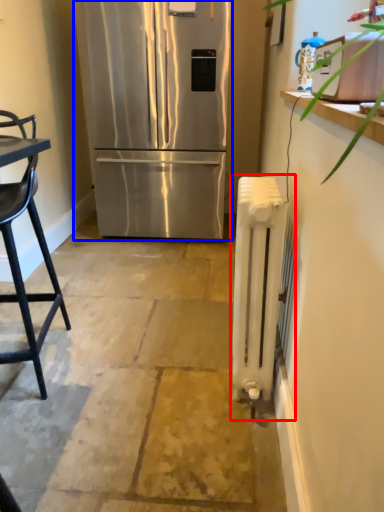
Question: Which object appears closest to the camera in this image, radiator (highlighted by a red box) or refrigerator (highlighted by a blue box)?

Choices:
 (A) radiator
 (B) refrigerator

Answer: (A)